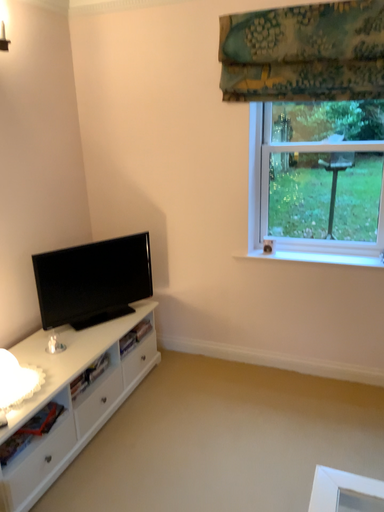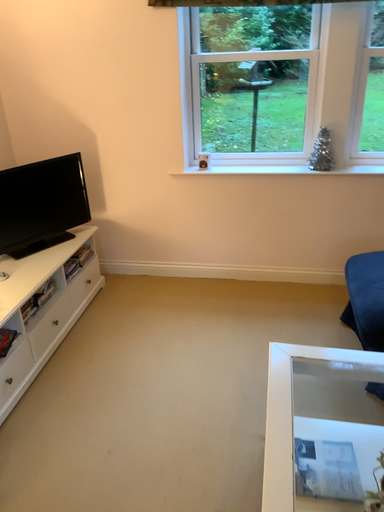
Question: Which way did the camera rotate in the video?

Choices:
 (A) rotated right
 (B) rotated left

Answer: (A)